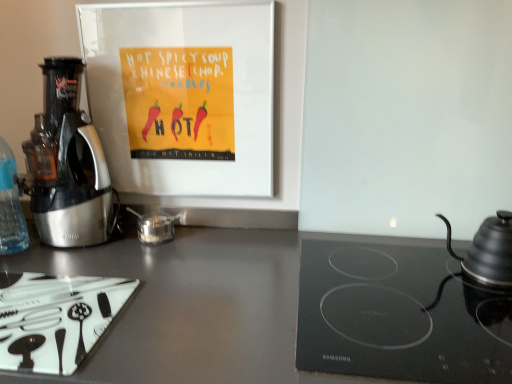
Where is `vacant area that is situated to the right of metallic silver coffee maker at left`? vacant area that is situated to the right of metallic silver coffee maker at left is located at coordinates (151, 251).